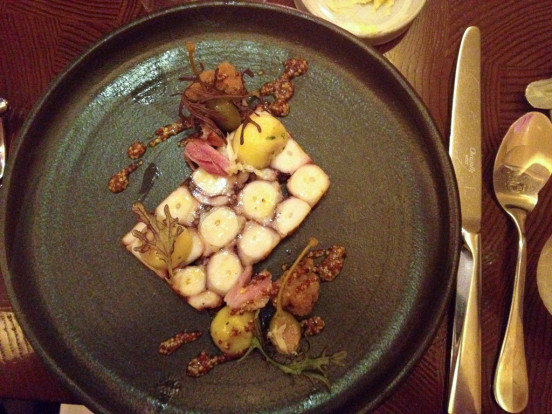
This screenshot has height=414, width=552. Find the location of `knife handle`. knife handle is located at coordinates (470, 339).